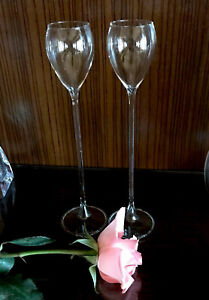
At what (x,y) coordinates should I click in order to perform the action: click on black table. Please return your answer as a coordinate pair (x, y). Looking at the image, I should click on (173, 261).